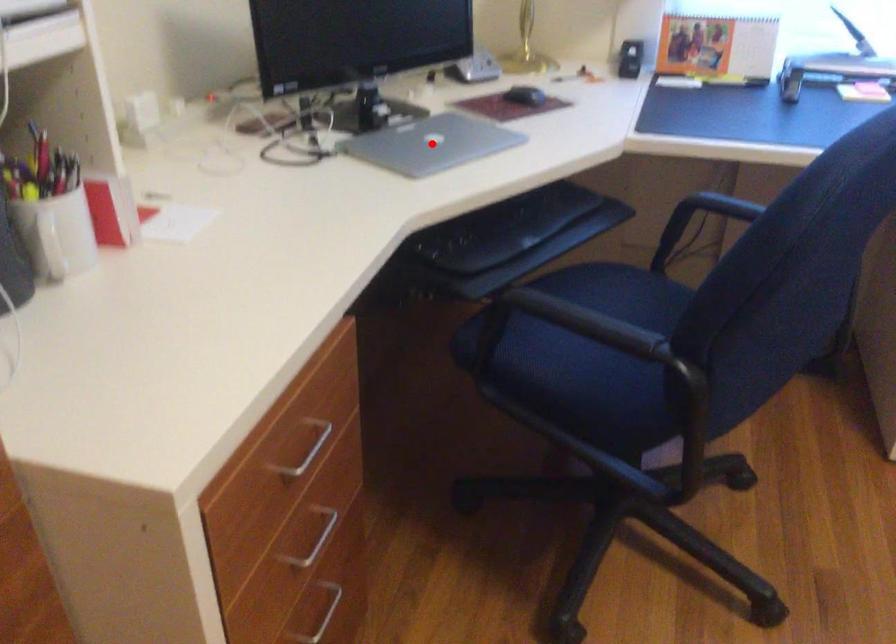
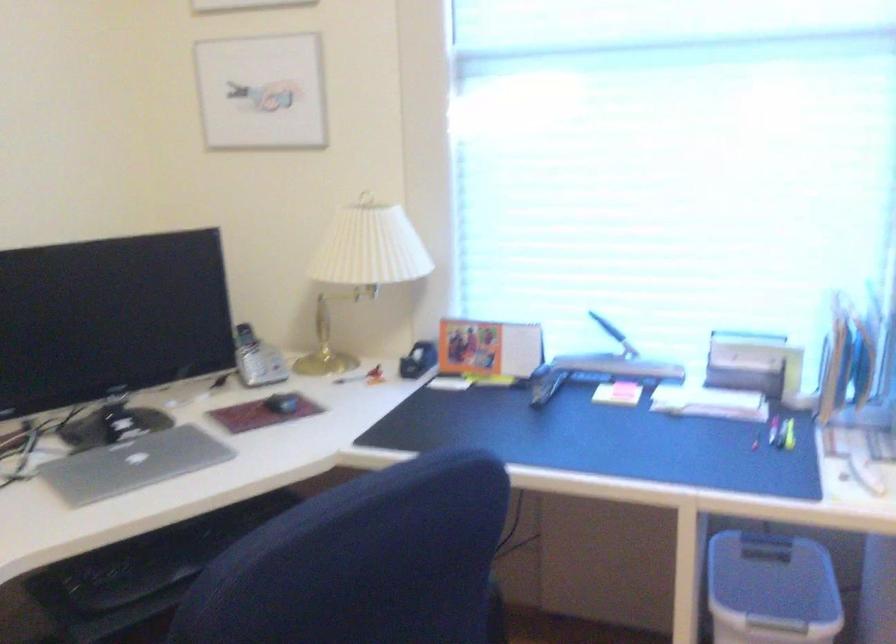
Locate, in the second image, the point that corresponds to the highlighted location in the first image.

(133, 464)